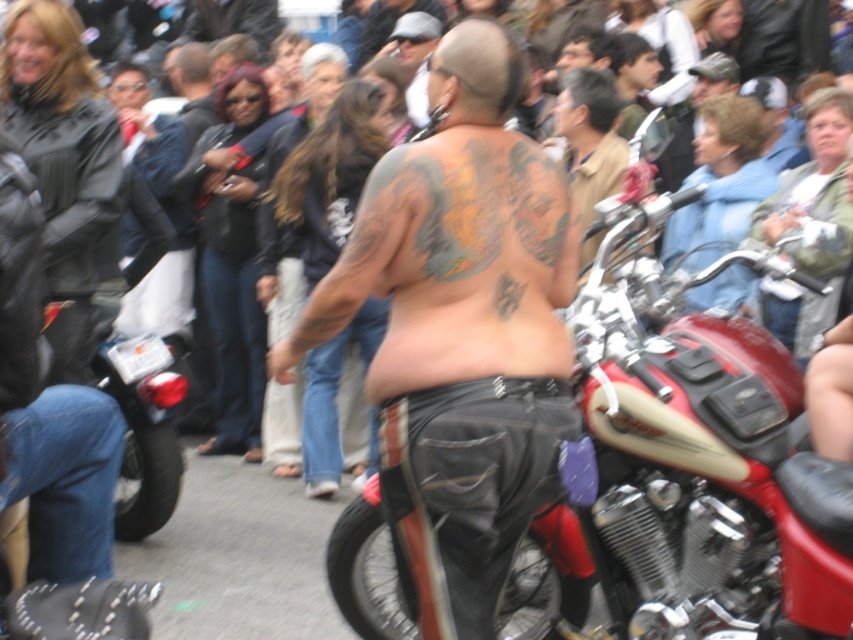
Which is more to the left, shiny metallic tank top at center or shiny silver motorcycle at center?

shiny metallic tank top at center is more to the left.

Based on the photo, does shiny metallic tank top at center appear on the left side of shiny silver motorcycle at center?

Indeed, shiny metallic tank top at center is positioned on the left side of shiny silver motorcycle at center.

Does point (402, 145) come in front of point (596, 112)?

Yes.

Where is `shiny metallic tank top at center`? shiny metallic tank top at center is located at coordinates (460, 332).

Does shiny chrome motorcycle at center come behind shiny metallic tank top at center?

That is True.

Between point (643, 540) and point (515, 477), which one is positioned behind?

Positioned behind is point (643, 540).

The height and width of the screenshot is (640, 853). I want to click on shiny chrome motorcycle at center, so click(x=680, y=465).

Is point (752, 577) closer to camera compared to point (601, 104)?

Yes, it is in front of point (601, 104).

Does shiny chrome motorcycle at center have a lesser width compared to shiny silver motorcycle at center?

In fact, shiny chrome motorcycle at center might be wider than shiny silver motorcycle at center.

Between point (759, 426) and point (556, 97), which one is positioned in front?

Point (759, 426) is in front.

Where is `shiny chrome motorcycle at center`? The image size is (853, 640). shiny chrome motorcycle at center is located at coordinates (680, 465).